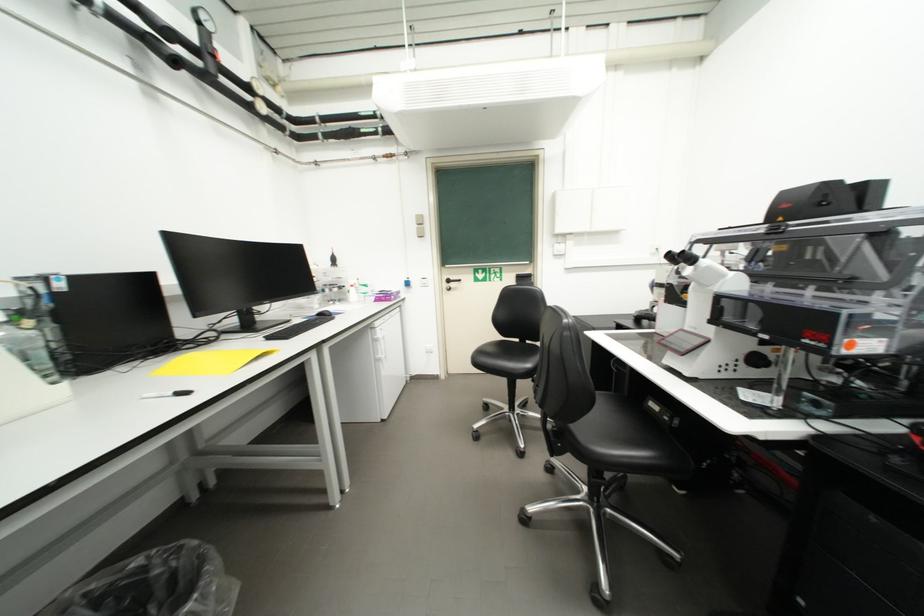
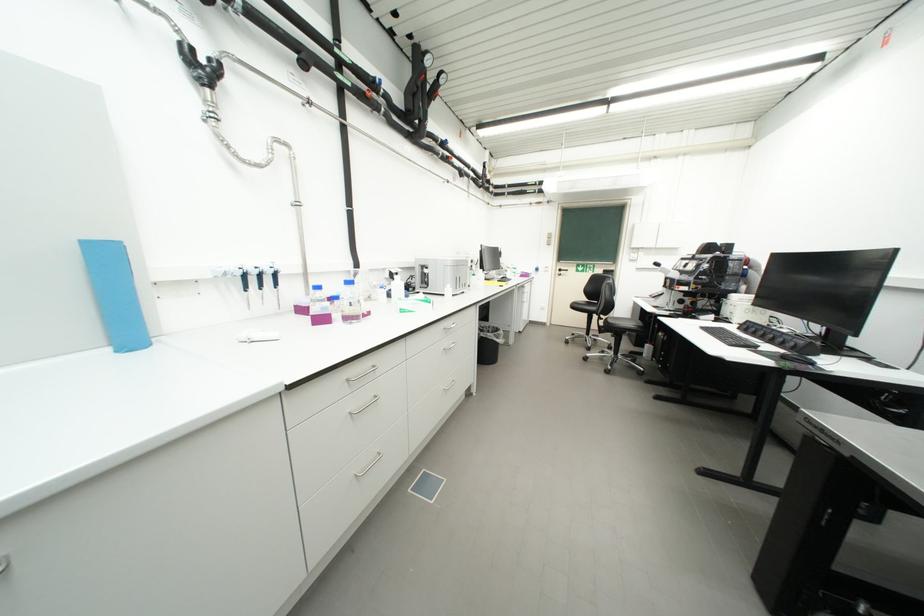
Question: I am providing you with two images of the same scene from different viewpoints. Which of the following objects are not visible in image2?

Choices:
 (A) microscope focus knob
 (B) computer keyboard
 (C) blue table marker
 (D) chair sitting surface

Answer: (A)